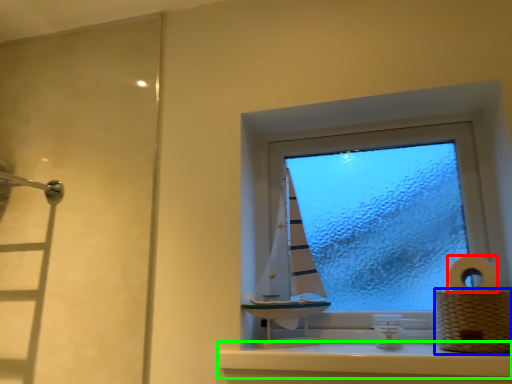
Question: Based on their relative distances, which object is nearer to toilet paper (highlighted by a red box)? Choose from basket (highlighted by a blue box) and window sill (highlighted by a green box).

Choices:
 (A) basket
 (B) window sill

Answer: (A)